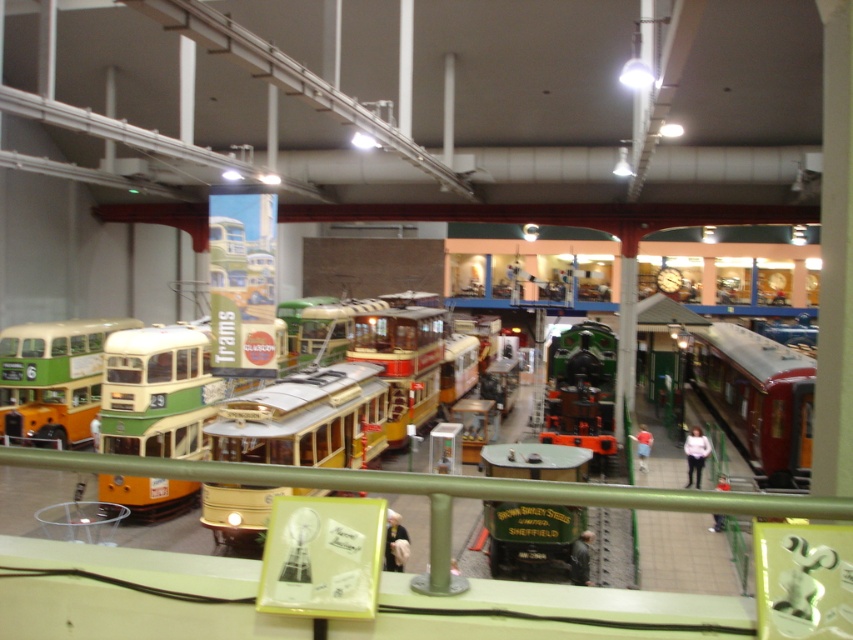
In the scene shown: You are standing in the museum and want to take a photo of the gold metallic tram at center. Your camera has a maximum focus range of 8 feet. Can you capture a clear photo without moving closer?

The gold metallic tram at center is 8.70 feet away from the viewer. Since the camera can only focus up to 8 feet, it cannot capture a clear photo without moving closer.